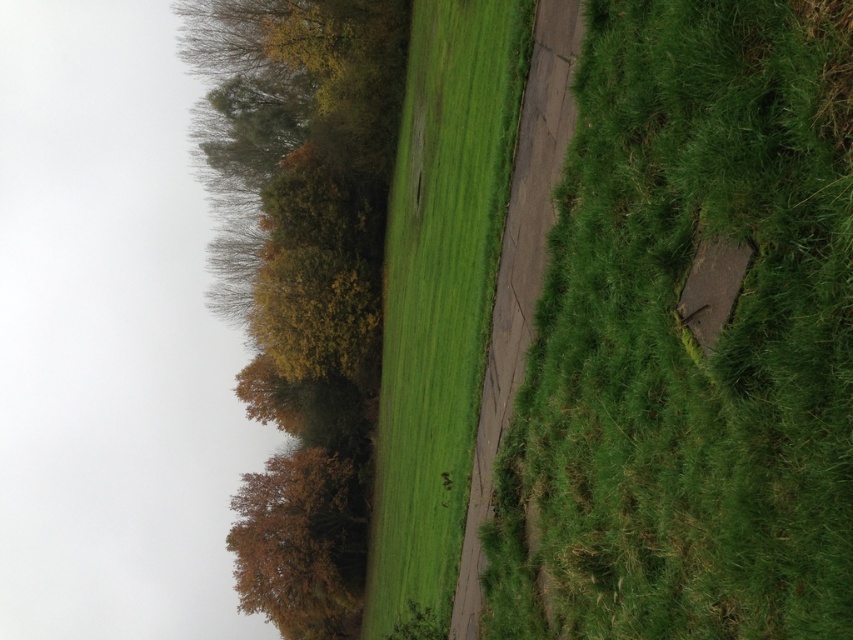
Does green grassy at right lie behind yellow-green foliage at upper left?

No, it is not.

The height and width of the screenshot is (640, 853). I want to click on green grassy at right, so click(x=688, y=344).

Locate an element on the screen. The image size is (853, 640). green grassy at right is located at coordinates (688, 344).

Which is behind, point (322, 493) or point (405, 429)?

The point (322, 493) is behind.

Who is lower down, yellow-green foliage at upper left or green grassy at center?

green grassy at center is below.

Identify the location of yellow-green foliage at upper left. The height and width of the screenshot is (640, 853). (302, 275).

At what (x,y) coordinates should I click in order to perform the action: click on yellow-green foliage at upper left. Please return your answer as a coordinate pair (x, y). This screenshot has height=640, width=853. Looking at the image, I should click on (302, 275).

Who is lower down, green grassy at right or green grassy at center?

green grassy at center is lower down.

Between point (677, 611) and point (433, 380), which one is positioned behind?

The point (433, 380) is more distant.

This screenshot has height=640, width=853. Describe the element at coordinates (688, 344) in the screenshot. I see `green grassy at right` at that location.

You are a GUI agent. You are given a task and a screenshot of the screen. Output one action in this format:
    pyautogui.click(x=<x>, y=<y>)
    Task: Click on the green grassy at right
    The width and height of the screenshot is (853, 640).
    Given the screenshot: What is the action you would take?
    pyautogui.click(x=688, y=344)